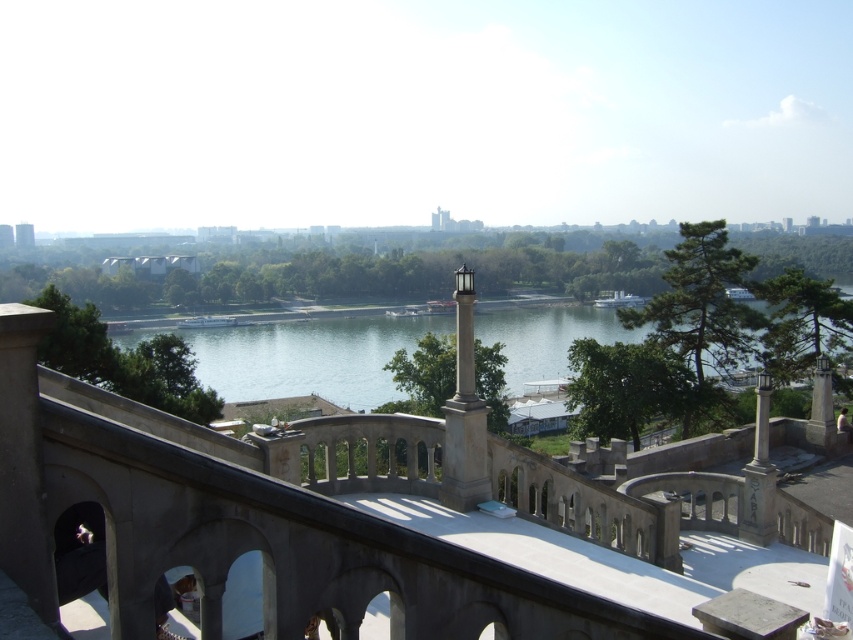
You are standing on the concrete balcony at center and want to walk to the white stone column at center. Which direction should you move relative to the column?

You should move to the left relative to the white stone column at center because the concrete balcony at center is on its right side.

You are standing on the concrete balcony at center and want to see the white stone column at center. Can you see it clearly from your current position?

The concrete balcony at center is in front of the white stone column at center, so the balcony may block your view of the column.